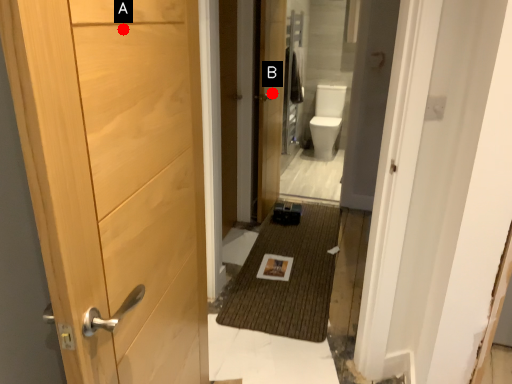
Question: Two points are circled on the image, labeled by A and B beside each circle. Which point appears closest to the camera in this image?

Choices:
 (A) A is closer
 (B) B is closer

Answer: (A)